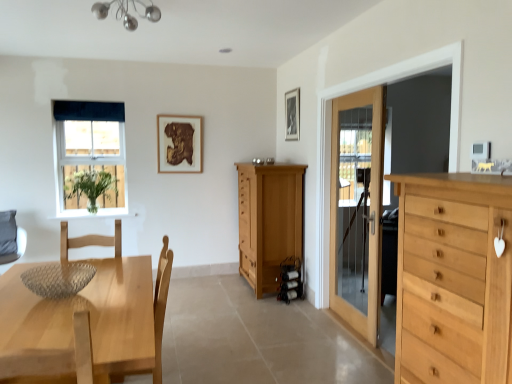
Question: Is light wood chest of drawers at right, the second chest of drawers when ordered from left to right, facing away from green matte vase at left?

Choices:
 (A) yes
 (B) no

Answer: (B)

Question: Is light wood chest of drawers at right, the second chest of drawers when ordered from left to right, wider than green matte vase at left?

Choices:
 (A) no
 (B) yes

Answer: (B)

Question: Is light wood chest of drawers at right, acting as the 1th chest of drawers starting from the right, taller than green matte vase at left?

Choices:
 (A) yes
 (B) no

Answer: (A)

Question: From a real-world perspective, is light wood chest of drawers at right, placed as the 2th chest of drawers when sorted from back to front, located higher than green matte vase at left?

Choices:
 (A) yes
 (B) no

Answer: (B)

Question: Does light wood chest of drawers at right, acting as the 1th chest of drawers starting from the right, have a smaller size compared to green matte vase at left?

Choices:
 (A) no
 (B) yes

Answer: (A)

Question: Considering the relative positions of natural wood cabinet at center, the 2th chest of drawers viewed from the front, and light brown wooden table at lower left in the image provided, is natural wood cabinet at center, the 2th chest of drawers viewed from the front, to the left or to the right of light brown wooden table at lower left?

Choices:
 (A) left
 (B) right

Answer: (B)

Question: In terms of width, does natural wood cabinet at center, which appears as the 1th chest of drawers when viewed from the left, look wider or thinner when compared to light brown wooden table at lower left?

Choices:
 (A) wide
 (B) thin

Answer: (B)

Question: Relative to light brown wooden table at lower left, is natural wood cabinet at center, which appears as the 1th chest of drawers when viewed from the back, in front or behind?

Choices:
 (A) front
 (B) behind

Answer: (B)

Question: Considering the positions of natural wood cabinet at center, the 2th chest of drawers viewed from the front, and light brown wooden table at lower left in the image, is natural wood cabinet at center, the 2th chest of drawers viewed from the front, bigger or smaller than light brown wooden table at lower left?

Choices:
 (A) big
 (B) small

Answer: (B)

Question: In terms of width, does gray fabric swivel chair at lower left look wider or thinner when compared to metallic glass chandelier at upper center?

Choices:
 (A) wide
 (B) thin

Answer: (A)

Question: Would you say gray fabric swivel chair at lower left is to the left or to the right of metallic glass chandelier at upper center in the picture?

Choices:
 (A) left
 (B) right

Answer: (A)

Question: Relative to metallic glass chandelier at upper center, is gray fabric swivel chair at lower left in front or behind?

Choices:
 (A) front
 (B) behind

Answer: (B)

Question: Considering the positions of gray fabric swivel chair at lower left and metallic glass chandelier at upper center in the image, is gray fabric swivel chair at lower left bigger or smaller than metallic glass chandelier at upper center?

Choices:
 (A) small
 (B) big

Answer: (B)

Question: Based on their positions, is light wood chair at lower left located to the left or right of black matte picture frame at upper center, positioned as the 1th picture frame in front-to-back order?

Choices:
 (A) right
 (B) left

Answer: (B)

Question: In terms of height, does light wood chair at lower left look taller or shorter compared to black matte picture frame at upper center, placed as the 1th picture frame when sorted from right to left?

Choices:
 (A) tall
 (B) short

Answer: (A)